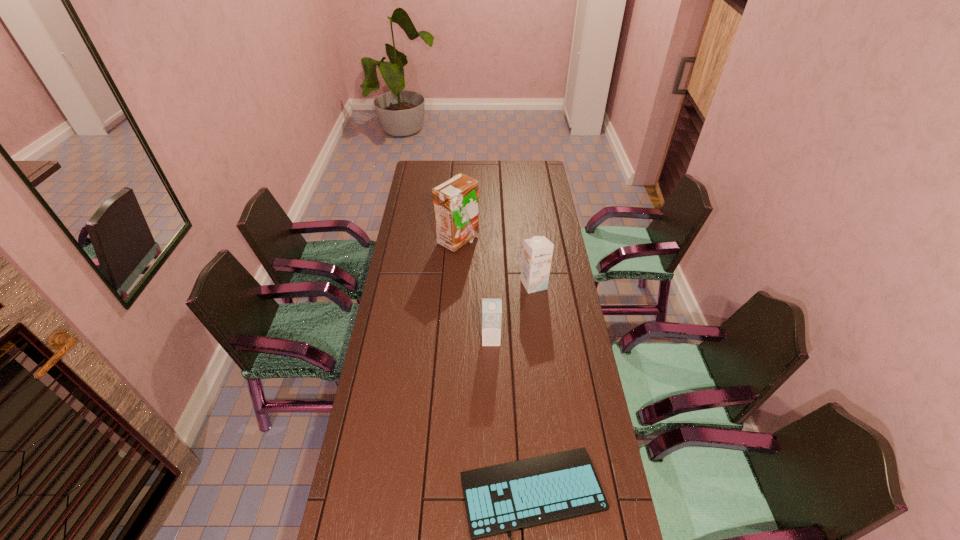
At what (x,y) coordinates should I click in order to perform the action: click on vacant space at the far edge. Please return your answer as a coordinate pair (x, y). The image size is (960, 540). Looking at the image, I should click on (467, 173).

In the image, there is a desktop. At what (x,y) coordinates should I click in order to perform the action: click on vacant space at the left edge. Please return your answer as a coordinate pair (x, y). The height and width of the screenshot is (540, 960). Looking at the image, I should click on (408, 232).

This screenshot has width=960, height=540. What are the coordinates of `free space at the right edge of the desktop` in the screenshot? It's located at pyautogui.click(x=566, y=410).

At what (x,y) coordinates should I click in order to perform the action: click on free region at the far left corner of the desktop. Please return your answer as a coordinate pair (x, y). This screenshot has height=540, width=960. Looking at the image, I should click on (434, 167).

Where is `vacant area that lies between the second farthest carton and the nearest carton`? vacant area that lies between the second farthest carton and the nearest carton is located at coordinates (513, 312).

Locate an element on the screen. free area in between the farthest object and the second carton from right to left is located at coordinates (474, 290).

Where is `free space between the farthest carton and the third farthest object`? The image size is (960, 540). free space between the farthest carton and the third farthest object is located at coordinates (474, 290).

Locate an element on the screen. This screenshot has width=960, height=540. free space between the third nearest object and the leftmost carton is located at coordinates (495, 262).

At what (x,y) coordinates should I click in order to perform the action: click on free point between the third nearest object and the farthest object. Please return your answer as a coordinate pair (x, y). Looking at the image, I should click on (495, 262).

Find the location of `free space between the farthest carton and the second farthest carton`. free space between the farthest carton and the second farthest carton is located at coordinates (495, 262).